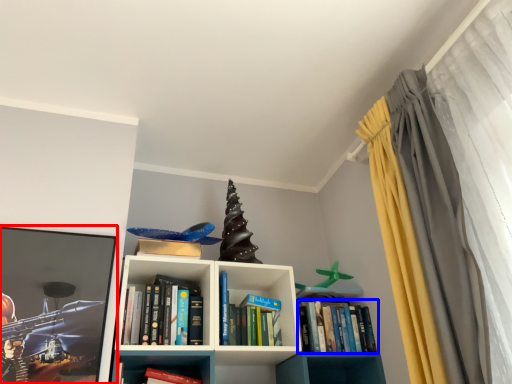
Question: Which point is closer to the camera, picture frame (highlighted by a red box) or book (highlighted by a blue box)?

Choices:
 (A) picture frame
 (B) book

Answer: (A)